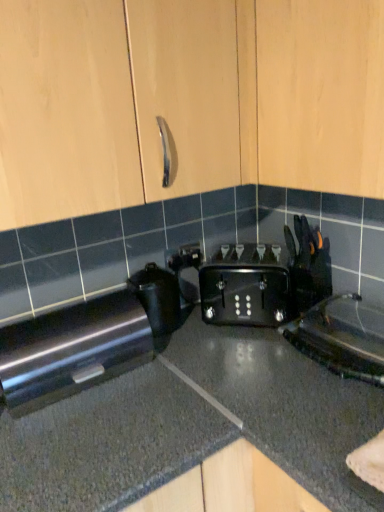
Question: Does black granite countertop at center have a lesser width compared to black plastic kettle at lower right, the first appliance positioned from the right?

Choices:
 (A) yes
 (B) no

Answer: (B)

Question: Does black granite countertop at center have a smaller size compared to black plastic kettle at lower right, the 2th appliance in the left-to-right sequence?

Choices:
 (A) no
 (B) yes

Answer: (A)

Question: Considering the relative sizes of black granite countertop at center and black plastic kettle at lower right, the first appliance positioned from the right, in the image provided, is black granite countertop at center wider than black plastic kettle at lower right, the first appliance positioned from the right,?

Choices:
 (A) no
 (B) yes

Answer: (B)

Question: Is black granite countertop at center positioned with its back to black plastic kettle at lower right, the first appliance positioned from the right?

Choices:
 (A) no
 (B) yes

Answer: (A)

Question: From the image's perspective, is black granite countertop at center located above black plastic kettle at lower right, the first appliance positioned from the right?

Choices:
 (A) yes
 (B) no

Answer: (B)

Question: From the image's perspective, does black granite countertop at center appear lower than black plastic kettle at lower right, the first appliance positioned from the right?

Choices:
 (A) no
 (B) yes

Answer: (B)

Question: From the image's perspective, does black plastic kettle at lower right, the first appliance positioned from the right, appear lower than black granite countertop at center?

Choices:
 (A) yes
 (B) no

Answer: (B)

Question: Is black granite countertop at center located within black plastic kettle at lower right, the 2th appliance in the left-to-right sequence?

Choices:
 (A) no
 (B) yes

Answer: (A)

Question: Is black plastic kettle at lower right, the first appliance positioned from the right, closer to camera compared to black granite countertop at center?

Choices:
 (A) yes
 (B) no

Answer: (B)

Question: Is black plastic kettle at lower right, the 2th appliance in the left-to-right sequence, bigger than black granite countertop at center?

Choices:
 (A) no
 (B) yes

Answer: (A)

Question: Is black plastic kettle at lower right, the 2th appliance in the left-to-right sequence, wider than black granite countertop at center?

Choices:
 (A) no
 (B) yes

Answer: (A)

Question: Considering the relative sizes of black plastic kettle at lower right, the 2th appliance in the left-to-right sequence, and black granite countertop at center in the image provided, is black plastic kettle at lower right, the 2th appliance in the left-to-right sequence, smaller than black granite countertop at center?

Choices:
 (A) no
 (B) yes

Answer: (B)

Question: Is light wood cabinet at upper center positioned in front of black plastic toaster at center, which ranks as the first appliance in left-to-right order?

Choices:
 (A) no
 (B) yes

Answer: (B)